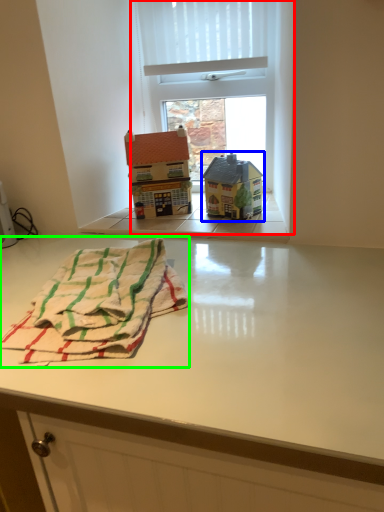
Question: Estimate the real-world distances between objects in this image. Which object is closer to window (highlighted by a red box), toy (highlighted by a blue box) or beach towel (highlighted by a green box)?

Choices:
 (A) toy
 (B) beach towel

Answer: (A)